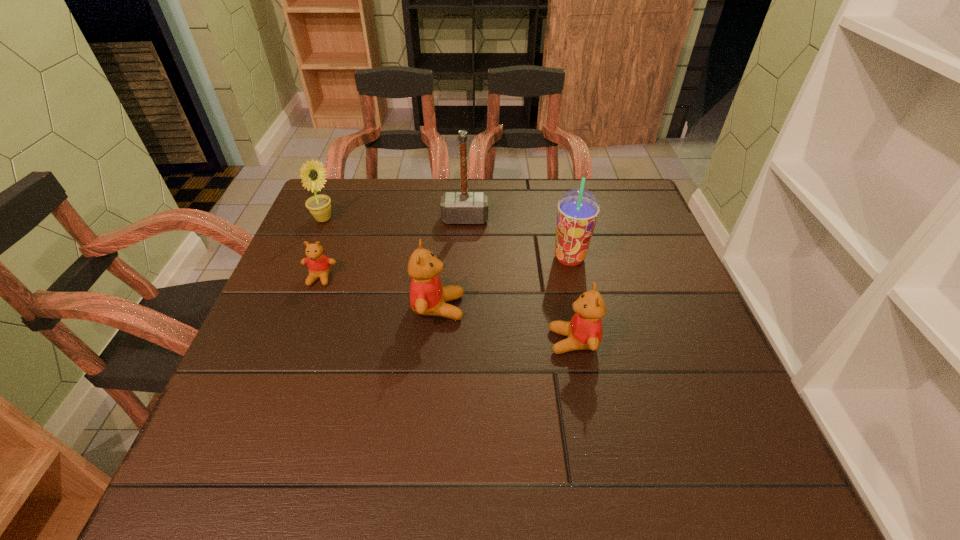
I want to click on the leftmost teddy bear, so click(x=319, y=265).

I want to click on the shortest object, so click(319, 265).

Identify the location of the second teddy bear from right to left. (427, 295).

This screenshot has height=540, width=960. What are the coordinates of `the rightmost teddy bear` in the screenshot? It's located at (584, 331).

Where is `the fifth tallest object`? This screenshot has height=540, width=960. the fifth tallest object is located at coordinates (584, 331).

The height and width of the screenshot is (540, 960). In order to click on hammer in this screenshot , I will do `click(464, 207)`.

Identify the location of sunflower. Image resolution: width=960 pixels, height=540 pixels. (312, 173).

Where is `smoothie`? The height and width of the screenshot is (540, 960). smoothie is located at coordinates (577, 211).

This screenshot has height=540, width=960. Find the location of `vacant space located 0.090m on the front-facing side of the leftmost teddy bear`. vacant space located 0.090m on the front-facing side of the leftmost teddy bear is located at coordinates (306, 316).

This screenshot has height=540, width=960. Identify the location of free space located on the front-facing side of the second teddy bear from right to left. (548, 307).